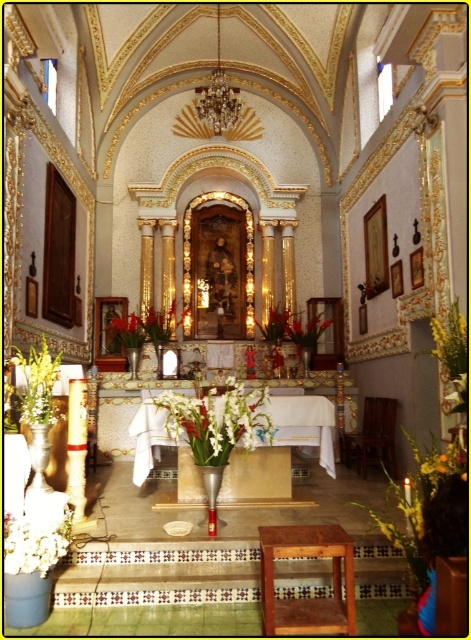
Can you confirm if brown wooden stool at lower center is shorter than white glossy vase at center?

Incorrect, brown wooden stool at lower center's height does not fall short of white glossy vase at center's.

Is brown wooden stool at lower center bigger than white glossy vase at center?

Incorrect, brown wooden stool at lower center is not larger than white glossy vase at center.

Does point (349, 552) come in front of point (216, 406)?

Yes.

You are a GUI agent. You are given a task and a screenshot of the screen. Output one action in this format:
    pyautogui.click(x=<x>, y=<y>)
    Task: Click on the brown wooden stool at lower center
    The image size is (471, 640).
    Given the screenshot: What is the action you would take?
    pyautogui.click(x=308, y=598)

Who is shorter, metallic vase at center or white matte flower at lower left?

white matte flower at lower left

The width and height of the screenshot is (471, 640). Identify the location of metallic vase at center. (146, 436).

Is point (331, 406) closer to viewer compared to point (48, 410)?

No, it is not.

Locate an element on the screen. metallic vase at center is located at coordinates (146, 436).

Measure the distance between metallic vase at center and camera.

They are 6.07 meters apart.

Where is `metallic vase at center`? metallic vase at center is located at coordinates (146, 436).